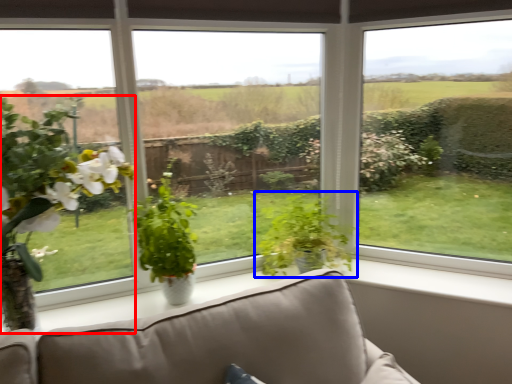
Question: Among these objects, which one is farthest to the camera, houseplant (highlighted by a red box) or houseplant (highlighted by a blue box)?

Choices:
 (A) houseplant
 (B) houseplant

Answer: (B)